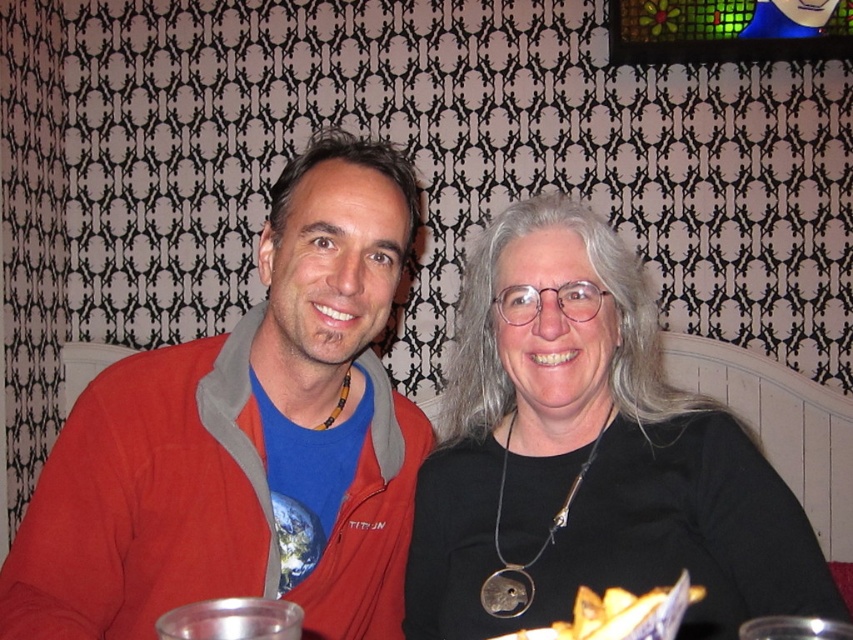
Can you confirm if matte red jacket at left is smaller than yellow crispy chips at lower center?

No, matte red jacket at left is not smaller than yellow crispy chips at lower center.

Between matte red jacket at left and yellow crispy chips at lower center, which one appears on the right side from the viewer's perspective?

yellow crispy chips at lower center is more to the right.

What do you see at coordinates (247, 440) in the screenshot? The height and width of the screenshot is (640, 853). I see `matte red jacket at left` at bounding box center [247, 440].

Locate an element on the screen. The height and width of the screenshot is (640, 853). matte red jacket at left is located at coordinates (247, 440).

Does matte red jacket at left lie behind black matte necklace at center?

No, matte red jacket at left is closer to the viewer.

Is matte red jacket at left below black matte necklace at center?

No.

Between point (184, 420) and point (537, 600), which one is positioned behind?

Point (184, 420)

The width and height of the screenshot is (853, 640). In order to click on matte red jacket at left in this screenshot , I will do `click(247, 440)`.

Locate an element on the screen. This screenshot has width=853, height=640. black matte necklace at center is located at coordinates (589, 454).

Between black matte necklace at center and yellow crispy chips at lower center, which one has less height?

With less height is yellow crispy chips at lower center.

Is point (564, 236) positioned before point (589, 618)?

No, (564, 236) is behind (589, 618).

At what (x,y) coordinates should I click in order to perform the action: click on black matte necklace at center. Please return your answer as a coordinate pair (x, y). Image resolution: width=853 pixels, height=640 pixels. Looking at the image, I should click on (589, 454).